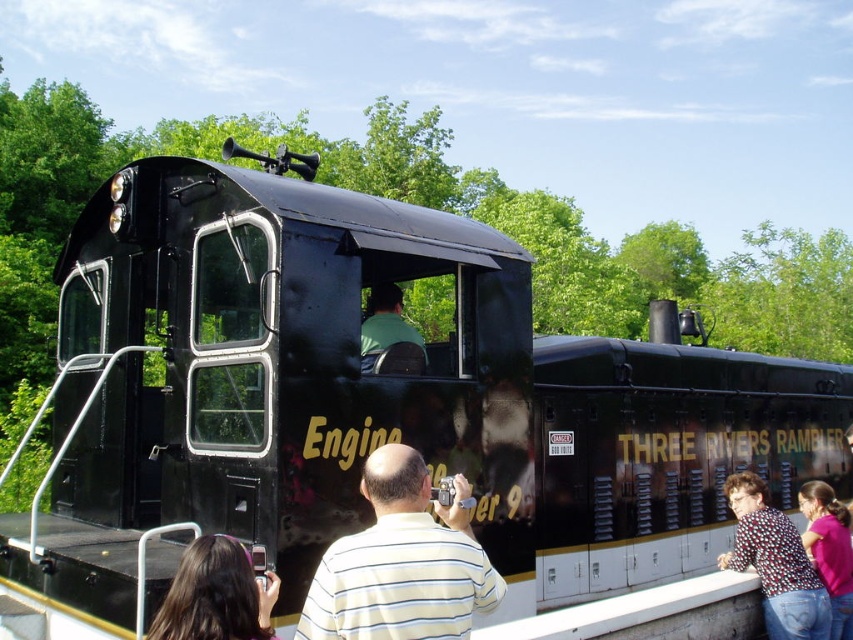
Question: Is pink fabric shirt at lower right to the right of green matte shirt at center from the viewer's perspective?

Choices:
 (A) yes
 (B) no

Answer: (A)

Question: Is printed fabric blouse at lower right thinner than green matte shirt at center?

Choices:
 (A) no
 (B) yes

Answer: (A)

Question: Which point is farther from the camera taking this photo?

Choices:
 (A) (788, 536)
 (B) (190, 605)

Answer: (A)

Question: Among these objects, which one is farthest from the camera?

Choices:
 (A) pink fabric shirt at lower right
 (B) green matte shirt at center

Answer: (A)

Question: Does pink fabric shirt at lower right appear over green matte shirt at center?

Choices:
 (A) yes
 (B) no

Answer: (B)

Question: Which object is farther from the camera taking this photo?

Choices:
 (A) pink fabric shirt at lower right
 (B) dark brown hair at lower left
 (C) printed fabric blouse at lower right
 (D) striped cotton shirt at center

Answer: (A)